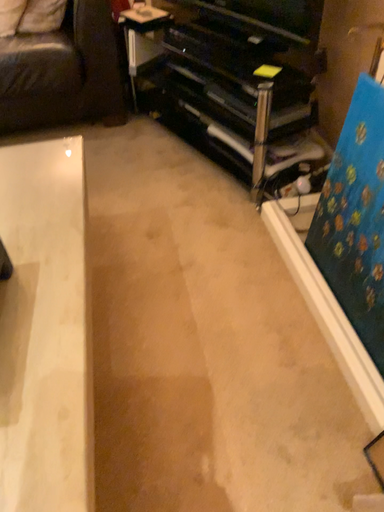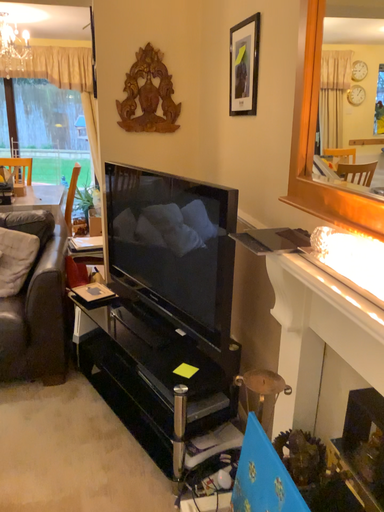
Question: How did the camera likely rotate when shooting the video?

Choices:
 (A) rotated downward
 (B) rotated upward

Answer: (B)